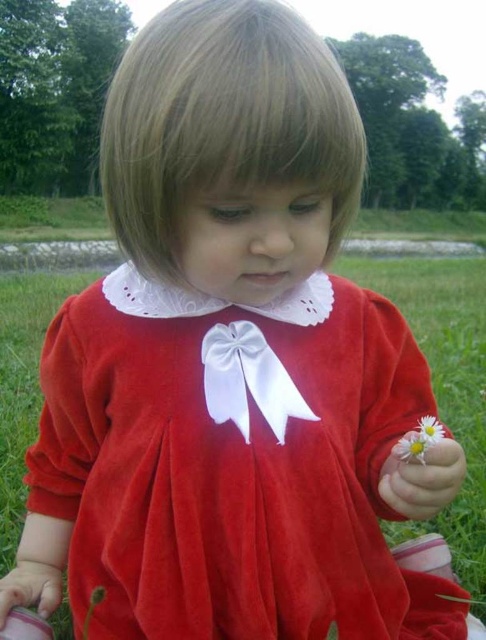
Question: Which of the following is the farthest from the observer?

Choices:
 (A) (204, 380)
 (B) (427, 442)

Answer: (A)

Question: Which point appears closest to the camera in this image?

Choices:
 (A) (277, 440)
 (B) (125, 532)
 (C) (421, 433)

Answer: (C)

Question: Does white soft daisy at lower right appear on the left side of white matte flower at lower right?

Choices:
 (A) yes
 (B) no

Answer: (A)

Question: Is white satin bow at center further to the viewer compared to white soft flower at lower right?

Choices:
 (A) no
 (B) yes

Answer: (B)

Question: Which object appears farthest from the camera in this image?

Choices:
 (A) white soft daisy at lower right
 (B) white matte flower at lower right

Answer: (B)

Question: Is velvet red dress at center positioned at the back of white satin bow at center?

Choices:
 (A) yes
 (B) no

Answer: (B)